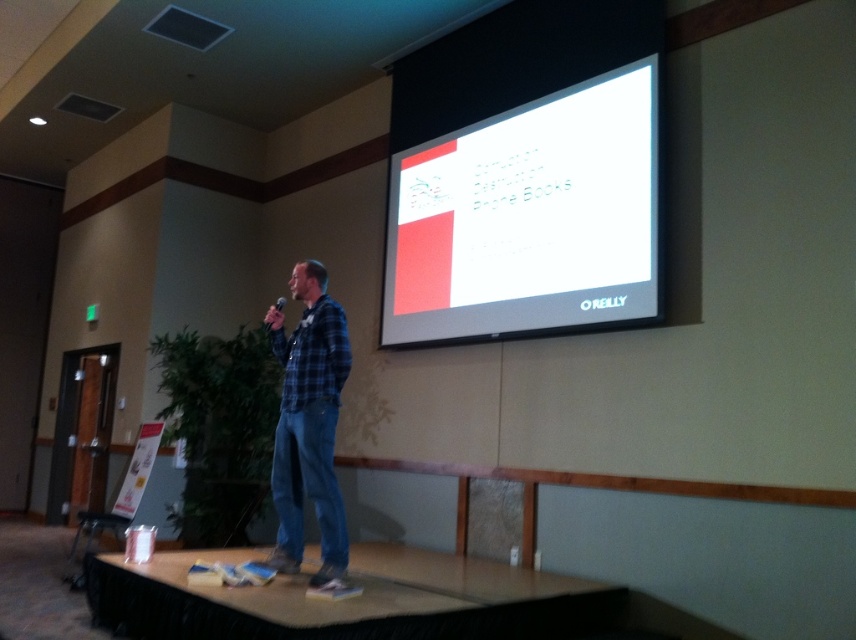
Between white glossy projection screen at upper center and matte black microphone at center, which one is positioned lower?

matte black microphone at center is lower down.

Does white glossy projection screen at upper center have a larger size compared to matte black microphone at center?

Yes, white glossy projection screen at upper center is bigger than matte black microphone at center.

The height and width of the screenshot is (640, 856). What do you see at coordinates (528, 218) in the screenshot? I see `white glossy projection screen at upper center` at bounding box center [528, 218].

Image resolution: width=856 pixels, height=640 pixels. In order to click on white glossy projection screen at upper center in this screenshot , I will do `click(528, 218)`.

Does point (593, 250) come in front of point (295, 496)?

No, it is behind (295, 496).

Is point (449, 202) behind point (304, 390)?

Yes, point (449, 202) is behind point (304, 390).

What do you see at coordinates (528, 218) in the screenshot? The image size is (856, 640). I see `white glossy projection screen at upper center` at bounding box center [528, 218].

This screenshot has height=640, width=856. Identify the location of white glossy projection screen at upper center. (528, 218).

Who is lower down, blue plaid shirt at center or matte black microphone at center?

Positioned lower is blue plaid shirt at center.

Can you confirm if blue plaid shirt at center is taller than matte black microphone at center?

Correct, blue plaid shirt at center is much taller as matte black microphone at center.

Does point (331, 445) lie behind point (277, 301)?

No, it is not.

Locate an element on the screen. blue plaid shirt at center is located at coordinates (308, 424).